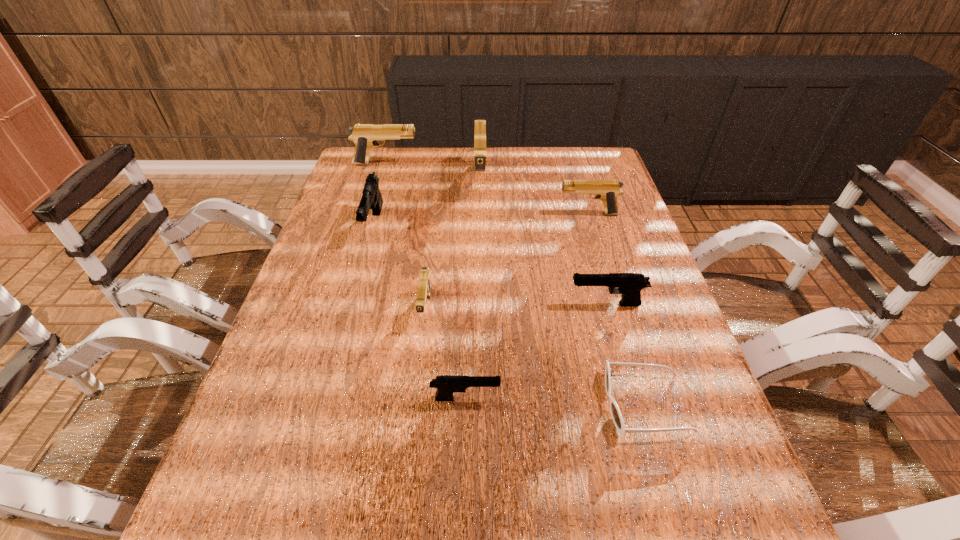
This screenshot has height=540, width=960. Find the location of `object located in the far left corner section of the desktop`. object located in the far left corner section of the desktop is located at coordinates [364, 136].

Where is `vacant space at the far edge`? vacant space at the far edge is located at coordinates (420, 181).

The height and width of the screenshot is (540, 960). Find the location of `blank space at the near edge of the desktop`. blank space at the near edge of the desktop is located at coordinates (636, 536).

The height and width of the screenshot is (540, 960). In order to click on vacant space at the left edge in this screenshot , I will do `click(360, 284)`.

This screenshot has height=540, width=960. In order to click on free space at the right edge in this screenshot , I will do `click(605, 230)`.

Locate an element on the screen. The width and height of the screenshot is (960, 540). free space between the smallest black pistol and the rightmost tan pistol is located at coordinates (527, 306).

What are the coordinates of `vacant region between the sunglasses and the farthest black pistol` in the screenshot? It's located at (510, 314).

At what (x,y) coordinates should I click in order to perform the action: click on free space between the black sunglasses and the second smallest tan pistol. Please return your answer as a coordinate pair (x, y). This screenshot has height=540, width=960. Looking at the image, I should click on (617, 309).

Identify the location of empty space between the second black pistol from left to right and the biggest tan pistol. (473, 290).

You are a GUI agent. You are given a task and a screenshot of the screen. Output one action in this format:
    pyautogui.click(x=<x>, y=<y>)
    Task: Click on the vacant area that lies between the second smallest tan pistol and the second farthest black pistol
    The width and height of the screenshot is (960, 540).
    Given the screenshot: What is the action you would take?
    pyautogui.click(x=597, y=259)